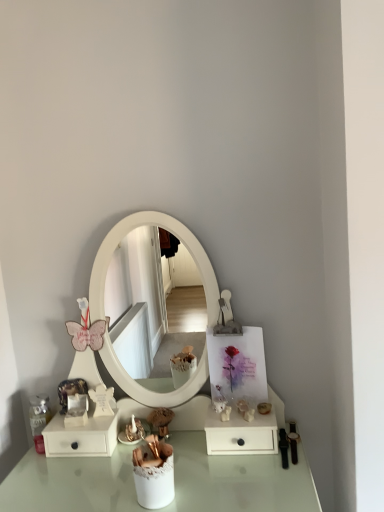
What do you see at coordinates (82, 437) in the screenshot?
I see `white matte drawer at lower left, positioned as the 2th dresser in right-to-left order` at bounding box center [82, 437].

This screenshot has height=512, width=384. What are the coordinates of `matte gold figurine at lower center` in the screenshot? It's located at (160, 421).

Considering the relative sizes of white matte drawer at lower right, placed as the second dresser when sorted from left to right, and matte gold figurine at lower center in the image provided, is white matte drawer at lower right, placed as the second dresser when sorted from left to right, wider than matte gold figurine at lower center?

Yes.

Can you confirm if white matte drawer at lower right, which ranks as the 1th dresser in right-to-left order, is bigger than matte gold figurine at lower center?

Indeed, white matte drawer at lower right, which ranks as the 1th dresser in right-to-left order, has a larger size compared to matte gold figurine at lower center.

Would you say white matte drawer at lower right, placed as the second dresser when sorted from left to right, is outside matte gold figurine at lower center?

white matte drawer at lower right, placed as the second dresser when sorted from left to right, is positioned outside matte gold figurine at lower center.

Is point (270, 426) positioned after point (164, 423)?

No, (270, 426) is in front of (164, 423).

Looking at the image, does white matte drawer at lower right, placed as the second dresser when sorted from left to right, seem bigger or smaller compared to white matte drawer at lower left, positioned as the 2th dresser in right-to-left order?

Considering their sizes, white matte drawer at lower right, placed as the second dresser when sorted from left to right, takes up less space than white matte drawer at lower left, positioned as the 2th dresser in right-to-left order.

Where is `dresser directly beneath the white matte drawer at lower left, positioned as the 1th dresser in left-to-right order (from a real-world perspective)`? Image resolution: width=384 pixels, height=512 pixels. dresser directly beneath the white matte drawer at lower left, positioned as the 1th dresser in left-to-right order (from a real-world perspective) is located at coordinates (241, 434).

From the image's perspective, who appears lower, white matte drawer at lower right, which ranks as the 1th dresser in right-to-left order, or white matte drawer at lower left, positioned as the 1th dresser in left-to-right order?

Answer: From the image's view, white matte drawer at lower left, positioned as the 1th dresser in left-to-right order, is below.

Which object is further away from the camera, white matte drawer at lower right, placed as the second dresser when sorted from left to right, or white matte drawer at lower left, positioned as the 2th dresser in right-to-left order?

white matte drawer at lower left, positioned as the 2th dresser in right-to-left order, is further from the camera.

You are a GUI agent. You are given a task and a screenshot of the screen. Output one action in this format:
    pyautogui.click(x=<x>, y=<y>)
    Task: Click on the dresser in front of the white matte drawer at lower left, positioned as the 1th dresser in left-to-right order
    The height and width of the screenshot is (512, 384).
    Given the screenshot: What is the action you would take?
    241,434

Between white matte drawer at lower left, positioned as the 2th dresser in right-to-left order, and white matte drawer at lower right, which ranks as the 1th dresser in right-to-left order, which one appears on the left side from the viewer's perspective?

white matte drawer at lower left, positioned as the 2th dresser in right-to-left order, is more to the left.

From the image's perspective, is white matte drawer at lower left, positioned as the 1th dresser in left-to-right order, located above or below white matte drawer at lower right, placed as the second dresser when sorted from left to right?

Clearly, from the image's perspective, white matte drawer at lower left, positioned as the 1th dresser in left-to-right order, is below white matte drawer at lower right, placed as the second dresser when sorted from left to right.

Based on the photo, how many degrees apart are the facing directions of matte gold figurine at lower center and white matte drawer at lower right, which ranks as the 1th dresser in right-to-left order?

matte gold figurine at lower center and white matte drawer at lower right, which ranks as the 1th dresser in right-to-left order, are facing 4.19 degrees away from each other.

Could white matte drawer at lower right, placed as the second dresser when sorted from left to right, be considered to be inside matte gold figurine at lower center?

Definitely not — white matte drawer at lower right, placed as the second dresser when sorted from left to right, is not inside matte gold figurine at lower center.

Is matte gold figurine at lower center positioned far away from white matte drawer at lower right, placed as the second dresser when sorted from left to right?

That's not correct — matte gold figurine at lower center is a little close to white matte drawer at lower right, placed as the second dresser when sorted from left to right.

Considering the points (160, 424) and (205, 421), which point is behind, point (160, 424) or point (205, 421)?

The point (160, 424) is farther.

From a real-world perspective, between white matte drawer at lower left, positioned as the 1th dresser in left-to-right order, and matte gold figurine at lower center, who is vertically lower?

matte gold figurine at lower center is physically lower.

Looking at this image, from the image's perspective, is white matte drawer at lower left, positioned as the 2th dresser in right-to-left order, over matte gold figurine at lower center?

Incorrect, from the image's perspective, white matte drawer at lower left, positioned as the 2th dresser in right-to-left order, is lower than matte gold figurine at lower center.

You are a GUI agent. You are given a task and a screenshot of the screen. Output one action in this format:
    pyautogui.click(x=<x>, y=<y>)
    Task: Click on the dresser on the left of matte gold figurine at lower center
    The image size is (384, 512).
    Given the screenshot: What is the action you would take?
    pyautogui.click(x=82, y=437)

From a real-world perspective, between matte gold figurine at lower center and white matte drawer at lower left, positioned as the 1th dresser in left-to-right order, who is vertically lower?

matte gold figurine at lower center, from a real-world perspective.

Based on the photo, which is more to the left, matte gold figurine at lower center or white matte drawer at lower left, positioned as the 1th dresser in left-to-right order?

white matte drawer at lower left, positioned as the 1th dresser in left-to-right order, is more to the left.

Can you confirm if matte gold figurine at lower center is smaller than white matte drawer at lower left, positioned as the 2th dresser in right-to-left order?

Yes.

In the scene shown: Is matte gold figurine at lower center closer to camera compared to white matte drawer at lower left, positioned as the 1th dresser in left-to-right order?

No, matte gold figurine at lower center is further to the viewer.

This screenshot has height=512, width=384. Find the location of `toy behind the white matte drawer at lower right, placed as the second dresser when sorted from left to right`. toy behind the white matte drawer at lower right, placed as the second dresser when sorted from left to right is located at coordinates (160, 421).

Locate an element on the screen. dresser that is above the white matte drawer at lower left, positioned as the 2th dresser in right-to-left order (from the image's perspective) is located at coordinates (241, 434).

Looking at the image, which one is located closer to white matte drawer at lower right, which ranks as the 1th dresser in right-to-left order, white matte drawer at lower left, positioned as the 2th dresser in right-to-left order, or matte gold figurine at lower center?

matte gold figurine at lower center.

Considering their positions, is matte gold figurine at lower center positioned closer to white matte drawer at lower left, positioned as the 1th dresser in left-to-right order, than white matte drawer at lower right, placed as the second dresser when sorted from left to right?

The object closer to white matte drawer at lower left, positioned as the 1th dresser in left-to-right order, is matte gold figurine at lower center.

From the image, which object appears to be nearer to white matte drawer at lower right, which ranks as the 1th dresser in right-to-left order, matte gold figurine at lower center or white matte drawer at lower left, positioned as the 1th dresser in left-to-right order?

Based on the image, matte gold figurine at lower center appears to be nearer to white matte drawer at lower right, which ranks as the 1th dresser in right-to-left order.

Looking at this image, based on their spatial positions, is white matte drawer at lower right, placed as the second dresser when sorted from left to right, or white matte drawer at lower left, positioned as the 2th dresser in right-to-left order, further from matte gold figurine at lower center?

white matte drawer at lower right, placed as the second dresser when sorted from left to right.

Which object lies further to the anchor point matte gold figurine at lower center, white matte drawer at lower left, positioned as the 2th dresser in right-to-left order, or white matte drawer at lower right, placed as the second dresser when sorted from left to right?

white matte drawer at lower right, placed as the second dresser when sorted from left to right.

Which object lies further to the anchor point white matte drawer at lower left, positioned as the 2th dresser in right-to-left order, white matte drawer at lower right, which ranks as the 1th dresser in right-to-left order, or matte gold figurine at lower center?

Based on the image, white matte drawer at lower right, which ranks as the 1th dresser in right-to-left order, appears to be further to white matte drawer at lower left, positioned as the 2th dresser in right-to-left order.

Locate an element on the screen. toy located between white matte drawer at lower left, positioned as the 1th dresser in left-to-right order, and white matte drawer at lower right, placed as the second dresser when sorted from left to right, in the left-right direction is located at coordinates (160, 421).